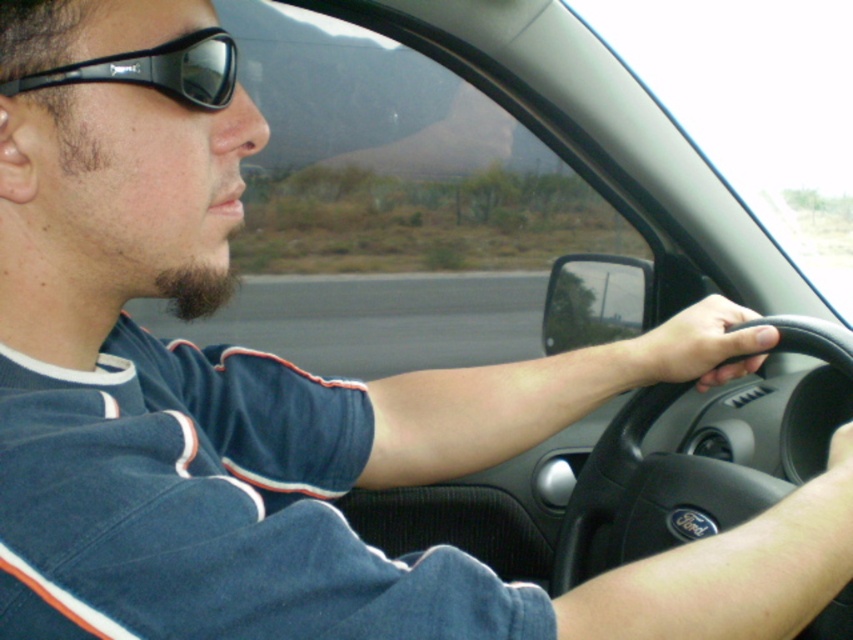
Question: Does black rubber steering wheel at center come in front of black rubber sunglasses at upper left?

Choices:
 (A) yes
 (B) no

Answer: (B)

Question: Does black rubber steering wheel at center have a greater width compared to black rubber sunglasses at upper left?

Choices:
 (A) no
 (B) yes

Answer: (B)

Question: Which point is farther to the camera?

Choices:
 (A) black rubber sunglasses at upper left
 (B) black rubber steering wheel at center

Answer: (B)

Question: From the image, what is the correct spatial relationship of black rubber steering wheel at center in relation to black rubber sunglasses at upper left?

Choices:
 (A) left
 (B) right

Answer: (B)

Question: Which object appears closest to the camera in this image?

Choices:
 (A) black rubber steering wheel at center
 (B) black rubber sunglasses at upper left

Answer: (B)

Question: Which point is closer to the camera?

Choices:
 (A) (199, 68)
 (B) (734, 464)

Answer: (A)